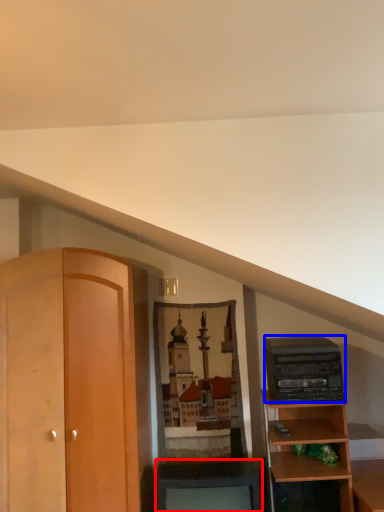
Question: Which object appears farthest to the camera in this image, cabinetry (highlighted by a red box) or stereo (highlighted by a blue box)?

Choices:
 (A) cabinetry
 (B) stereo

Answer: (B)